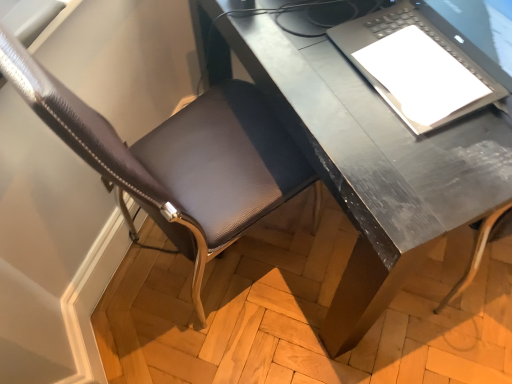
Question: Does matte black laptop at upper right appear on the left side of metallic gray desk at center?

Choices:
 (A) no
 (B) yes

Answer: (B)

Question: From the image's perspective, is matte black laptop at upper right beneath metallic gray desk at center?

Choices:
 (A) no
 (B) yes

Answer: (B)

Question: Is matte black laptop at upper right far away from metallic gray desk at center?

Choices:
 (A) yes
 (B) no

Answer: (B)

Question: Does matte black laptop at upper right contain metallic gray desk at center?

Choices:
 (A) yes
 (B) no

Answer: (B)

Question: Does matte black laptop at upper right lie behind metallic gray desk at center?

Choices:
 (A) yes
 (B) no

Answer: (B)

Question: Considering their positions, is matte black laptop at upper right located in front of or behind metallic gray desk at center?

Choices:
 (A) front
 (B) behind

Answer: (A)

Question: In terms of size, does matte black laptop at upper right appear bigger or smaller than metallic gray desk at center?

Choices:
 (A) small
 (B) big

Answer: (A)

Question: In terms of height, does matte black laptop at upper right look taller or shorter compared to metallic gray desk at center?

Choices:
 (A) short
 (B) tall

Answer: (A)

Question: In the image, is matte black laptop at upper right on the left side or the right side of metallic gray desk at center?

Choices:
 (A) left
 (B) right

Answer: (A)

Question: From the image's perspective, is metallic gray desk at center positioned above or below leather-like brown chair at lower left?

Choices:
 (A) below
 (B) above

Answer: (B)

Question: From a real-world perspective, is metallic gray desk at center positioned above or below leather-like brown chair at lower left?

Choices:
 (A) below
 (B) above

Answer: (A)

Question: Considering the positions of point (224, 28) and point (180, 203), is point (224, 28) closer or farther from the camera than point (180, 203)?

Choices:
 (A) farther
 (B) closer

Answer: (B)

Question: Based on their positions, is metallic gray desk at center located to the left or right of leather-like brown chair at lower left?

Choices:
 (A) right
 (B) left

Answer: (A)

Question: Is point (272, 198) positioned closer to the camera than point (485, 102)?

Choices:
 (A) closer
 (B) farther

Answer: (B)

Question: Is leather-like brown chair at lower left in front of or behind matte black laptop at upper right in the image?

Choices:
 (A) behind
 (B) front

Answer: (B)